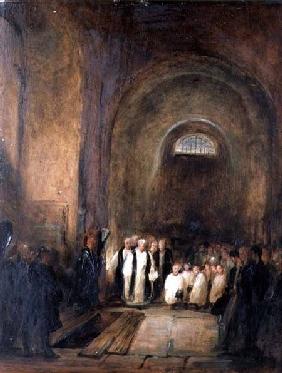
The image size is (282, 373). I want to click on wooden boards, so [72, 330], [103, 337], [121, 337].